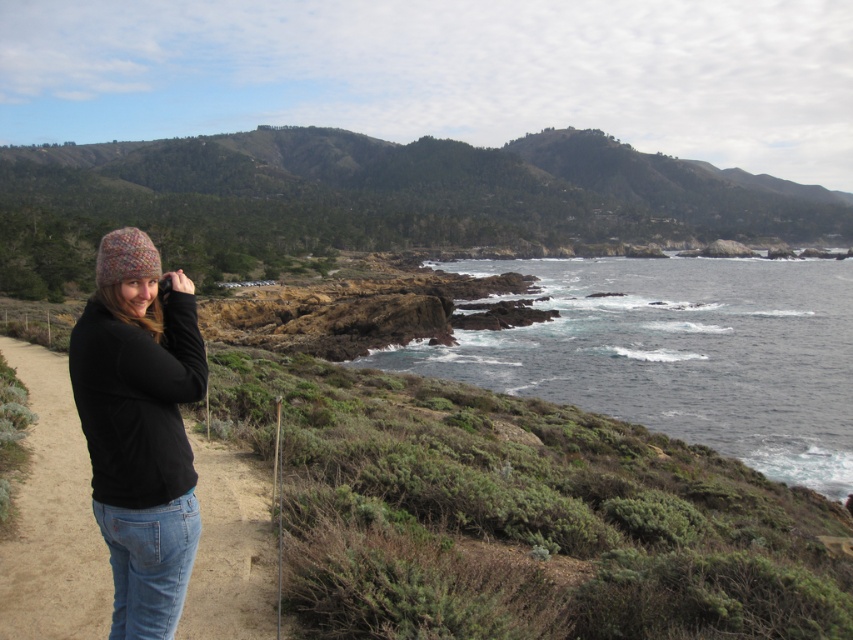
How far apart are green grassy hillside at upper center and knitted wool hat at left?

green grassy hillside at upper center and knitted wool hat at left are 275.23 meters apart from each other.

Does green grassy hillside at upper center come behind knitted wool hat at left?

Yes.

In the scene shown: Who is more forward, (x=141, y=141) or (x=183, y=506)?

Point (x=183, y=506) is more forward.

Where is `green grassy hillside at upper center`? This screenshot has height=640, width=853. green grassy hillside at upper center is located at coordinates (381, 198).

Is point (186, 600) positioned before point (115, 228)?

Yes, it is in front of point (115, 228).

Does black fabric path at lower left have a lesser height compared to knitted woolen hat at left?

No, black fabric path at lower left is not shorter than knitted woolen hat at left.

You are a GUI agent. You are given a task and a screenshot of the screen. Output one action in this format:
    pyautogui.click(x=<x>, y=<y>)
    Task: Click on the black fabric path at lower left
    
    Given the screenshot: What is the action you would take?
    pyautogui.click(x=51, y=516)

Is dark blue water at center below knitted wool hat at left?

Incorrect, dark blue water at center is not positioned below knitted wool hat at left.

Does dark blue water at center have a greater height compared to knitted wool hat at left?

Indeed, dark blue water at center has a greater height compared to knitted wool hat at left.

Identify the location of dark blue water at center. This screenshot has height=640, width=853. (679, 353).